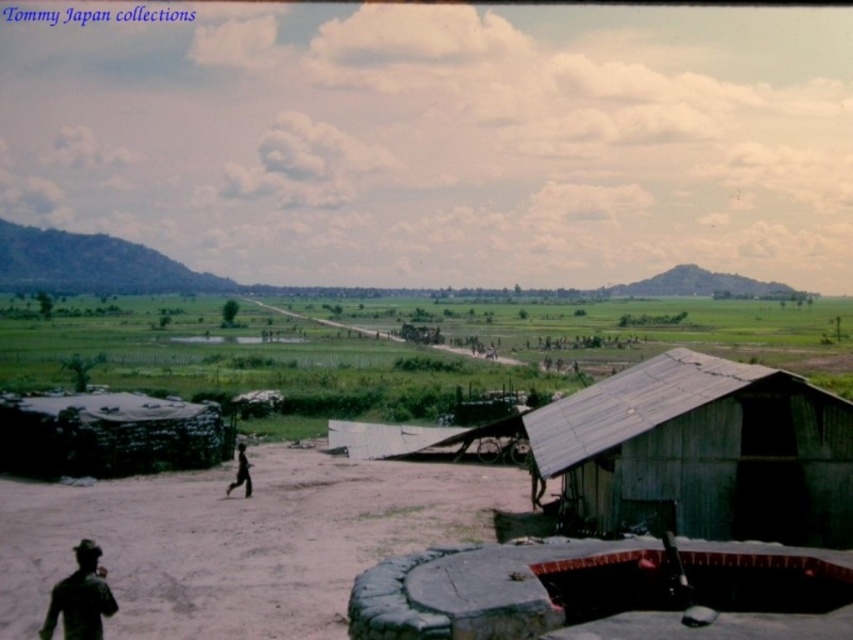
Is point (97, 593) positioned before point (248, 492)?

Yes, point (97, 593) is closer to viewer.

Who is positioned more to the left, dark green uniform at lower left or black matte figure at center?

black matte figure at center

Which is behind, point (100, 586) or point (242, 468)?

Positioned behind is point (242, 468).

Find the location of a particular element. Image resolution: width=853 pixels, height=640 pixels. dark green uniform at lower left is located at coordinates click(x=80, y=596).

Does wooden shack at lower right have a greater height compared to black matte figure at center?

Yes, wooden shack at lower right is taller than black matte figure at center.

Who is higher up, wooden shack at lower right or black matte figure at center?

Positioned higher is wooden shack at lower right.

Who is more forward, (x=767, y=397) or (x=229, y=484)?

Point (x=767, y=397)

Where is `wooden shack at lower right`? wooden shack at lower right is located at coordinates (701, 452).

Between point (693, 509) and point (91, 612), which one is positioned in front?

Point (91, 612)

What do you see at coordinates (701, 452) in the screenshot? I see `wooden shack at lower right` at bounding box center [701, 452].

Locate an element on the screen. wooden shack at lower right is located at coordinates (701, 452).

The image size is (853, 640). I want to click on wooden shack at lower right, so click(x=701, y=452).